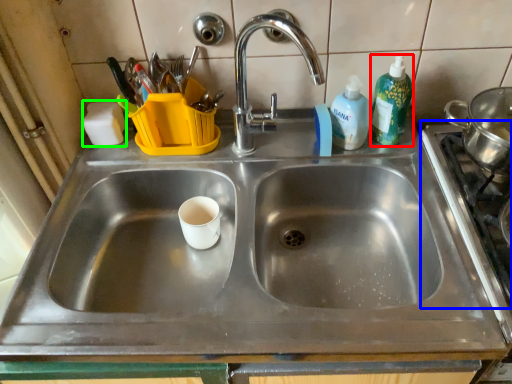
Question: Based on their relative distances, which object is nearer to cleaning product (highlighted by a red box)? Choose from gas stove (highlighted by a blue box) and soap (highlighted by a green box).

Choices:
 (A) gas stove
 (B) soap

Answer: (A)